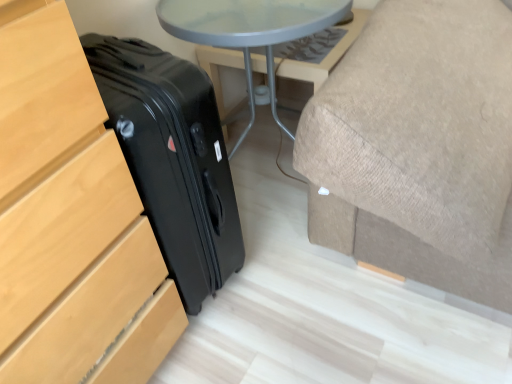
What do you see at coordinates (70, 220) in the screenshot? This screenshot has width=512, height=384. I see `black plastic suitcase at left` at bounding box center [70, 220].

Identify the location of black plastic suitcase at left. (70, 220).

Image resolution: width=512 pixels, height=384 pixels. I want to click on black plastic suitcase at left, so click(70, 220).